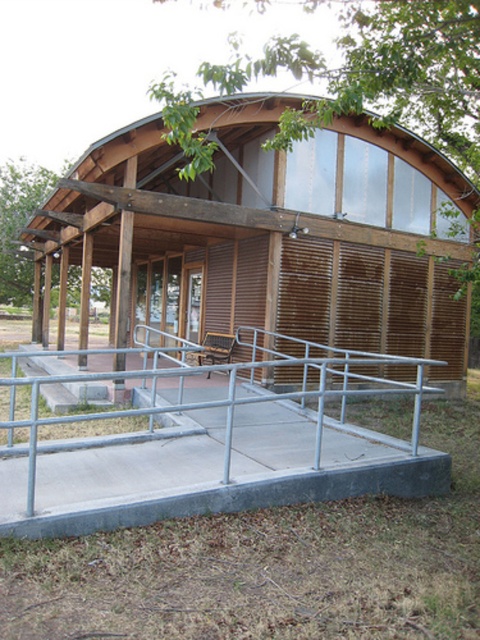
Question: Where is wooden hut at center located in relation to silver metallic rail at center in the image?

Choices:
 (A) right
 (B) left

Answer: (B)

Question: Which of the following is the farthest from the observer?

Choices:
 (A) (2, 531)
 (B) (307, 148)

Answer: (B)

Question: Which of the following is the farthest from the observer?

Choices:
 (A) (28, 349)
 (B) (314, 250)

Answer: (A)

Question: Considering the relative positions of wooden hut at center and silver metallic rail at center in the image provided, where is wooden hut at center located with respect to silver metallic rail at center?

Choices:
 (A) left
 (B) right

Answer: (A)

Question: Does wooden hut at center come in front of silver metallic rail at center?

Choices:
 (A) no
 (B) yes

Answer: (A)